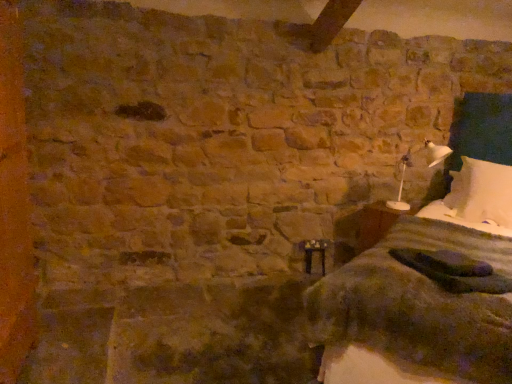
Question: From a real-world perspective, is white cotton bed at right located higher than wooden bedside table at lower right?

Choices:
 (A) yes
 (B) no

Answer: (A)

Question: Is white cotton bed at right facing away from wooden bedside table at lower right?

Choices:
 (A) yes
 (B) no

Answer: (B)

Question: Is white cotton bed at right at the left side of wooden bedside table at lower right?

Choices:
 (A) no
 (B) yes

Answer: (A)

Question: Can you confirm if white cotton bed at right is shorter than wooden bedside table at lower right?

Choices:
 (A) no
 (B) yes

Answer: (A)

Question: Does white cotton bed at right have a greater height compared to wooden bedside table at lower right?

Choices:
 (A) yes
 (B) no

Answer: (A)

Question: Considering their positions, is white plastic lamp at right located in front of or behind white soft pillow at right?

Choices:
 (A) front
 (B) behind

Answer: (A)

Question: From a real-world perspective, relative to white soft pillow at right, is white plastic lamp at right vertically above or below?

Choices:
 (A) below
 (B) above

Answer: (B)

Question: Is white plastic lamp at right bigger or smaller than white soft pillow at right?

Choices:
 (A) big
 (B) small

Answer: (B)

Question: Considering the positions of white plastic lamp at right and white soft pillow at right in the image, is white plastic lamp at right taller or shorter than white soft pillow at right?

Choices:
 (A) short
 (B) tall

Answer: (B)

Question: Based on their sizes in the image, would you say white soft pillow at right is bigger or smaller than white cotton bed at right?

Choices:
 (A) big
 (B) small

Answer: (B)

Question: Considering the positions of white soft pillow at right and white cotton bed at right in the image, is white soft pillow at right wider or thinner than white cotton bed at right?

Choices:
 (A) wide
 (B) thin

Answer: (B)

Question: Considering the positions of point (450, 215) and point (495, 137), is point (450, 215) closer or farther from the camera than point (495, 137)?

Choices:
 (A) closer
 (B) farther

Answer: (A)

Question: From a real-world perspective, is white soft pillow at right positioned above or below white cotton bed at right?

Choices:
 (A) above
 (B) below

Answer: (A)

Question: Considering the positions of point (508, 221) and point (394, 203), is point (508, 221) closer or farther from the camera than point (394, 203)?

Choices:
 (A) closer
 (B) farther

Answer: (A)

Question: From the image's perspective, is white soft pillow at right located above or below white plastic lamp at right?

Choices:
 (A) above
 (B) below

Answer: (B)